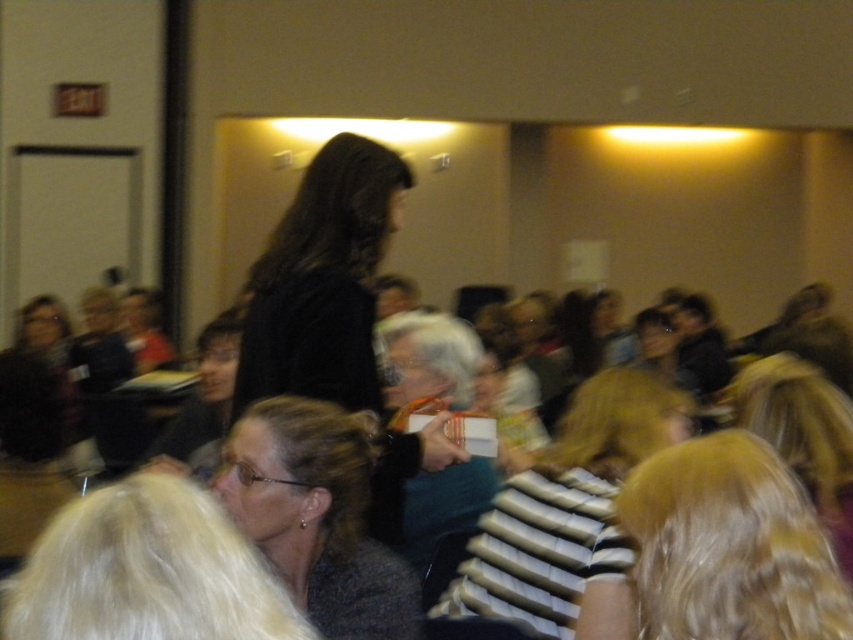
Question: Which of the following is the closest to the observer?

Choices:
 (A) (337, 604)
 (B) (625, 609)

Answer: (B)

Question: Among these points, which one is farthest from the camera?

Choices:
 (A) (358, 460)
 (B) (556, 449)

Answer: (B)

Question: Can you confirm if striped fabric bag at center is thinner than dark gray textured sweater at center?

Choices:
 (A) yes
 (B) no

Answer: (B)

Question: Does striped fabric bag at center have a greater width compared to dark gray textured sweater at center?

Choices:
 (A) no
 (B) yes

Answer: (B)

Question: Which of the following is the closest to the observer?

Choices:
 (A) (370, 576)
 (B) (639, 436)

Answer: (A)

Question: Does striped fabric bag at center lie in front of dark gray textured sweater at center?

Choices:
 (A) yes
 (B) no

Answer: (A)